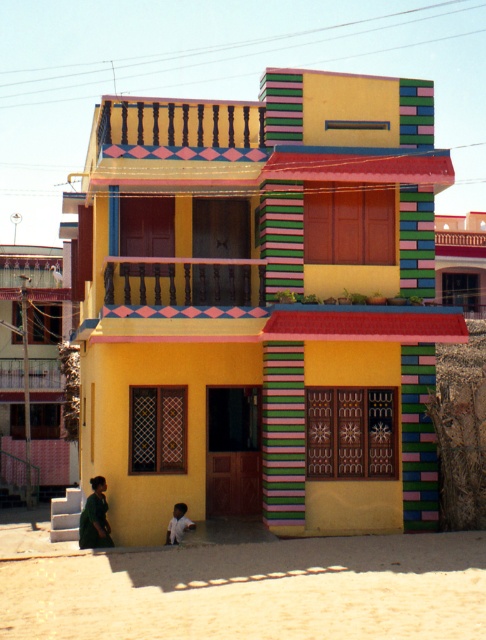
You are standing in front of the two story residential building and see the beige sandy ground at lower center and the light blue fabric shirt at lower center. Which object is bigger in size?

The beige sandy ground at lower center is larger in size than the light blue fabric shirt at lower center.

You are an interior designer planning to hang two decorative items on the wall of the building. The items must be placed at the same height as the green matte dress at lower left and the light blue fabric shirt at lower center. Which item will require a higher mounting point?

The green matte dress at lower left requires a higher mounting point since it has a greater height compared to the light blue fabric shirt at lower center.